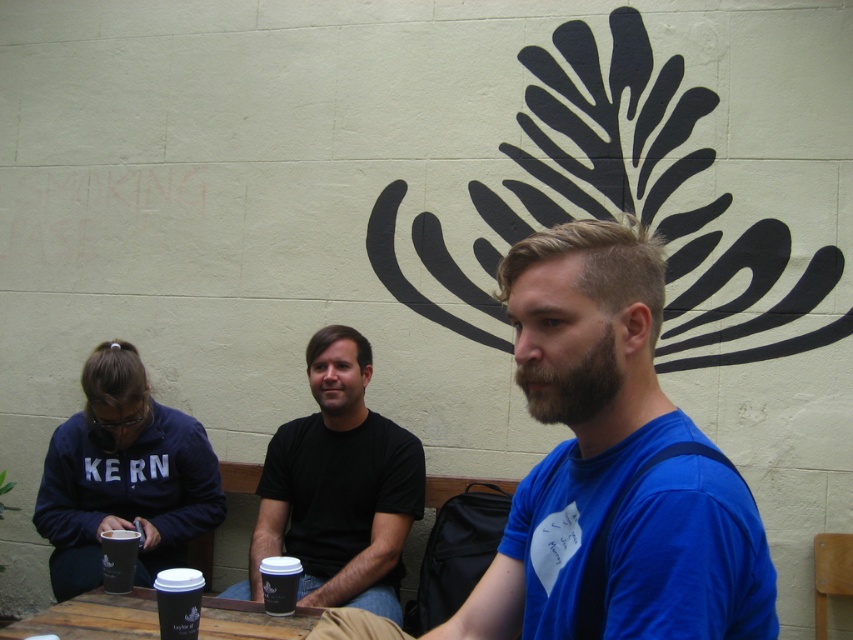
Question: Which object is farther from the camera taking this photo?

Choices:
 (A) black paper cup at center
 (B) wooden table at center
 (C) black paper cup at lower left

Answer: (A)

Question: Considering the real-world distances, which object is farthest from the wooden table at center?

Choices:
 (A) black paper cup at lower left
 (B) matte black cup at lower left
 (C) black paper cup at center
 (D) black matte t-shirt at center

Answer: (D)

Question: Which of the following is the closest to the observer?

Choices:
 (A) black paper cup at center
 (B) black matte t-shirt at center
 (C) matte black cup at lower left

Answer: (A)

Question: In this image, where is blue cotton shirt at center located relative to black paper cup at center?

Choices:
 (A) left
 (B) right

Answer: (B)

Question: Can you confirm if blue cotton shirt at center is positioned to the left of black paper cup at lower left?

Choices:
 (A) yes
 (B) no

Answer: (B)

Question: Does blue cotton shirt at center appear under matte black cup at lower left?

Choices:
 (A) yes
 (B) no

Answer: (B)